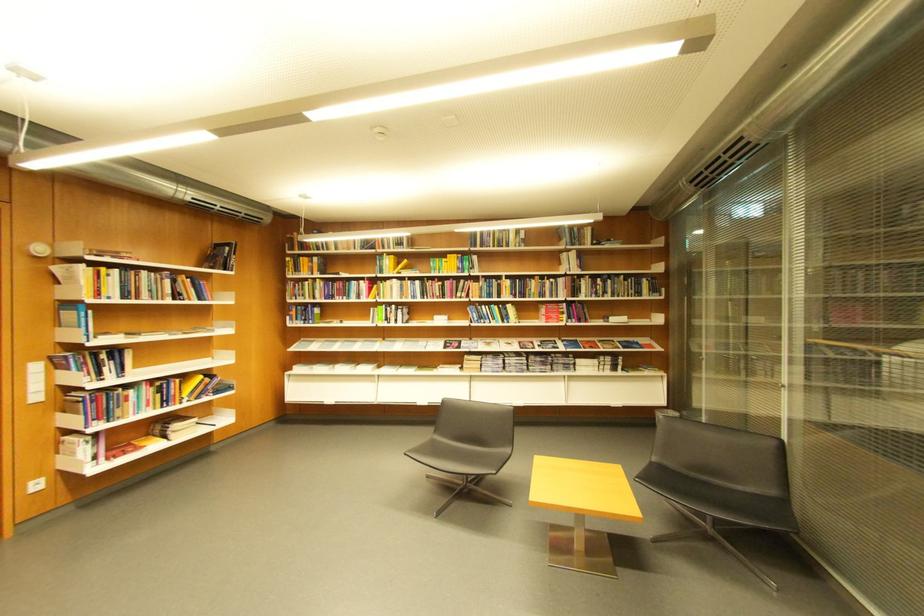
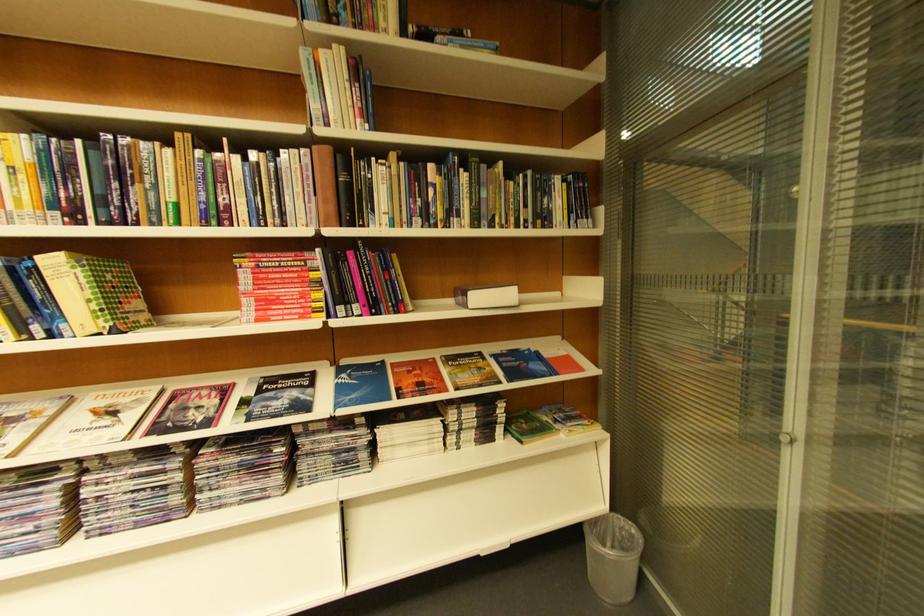
Where in the second image is the point corresponding to pixel 518 308 from the first image?

(63, 264)